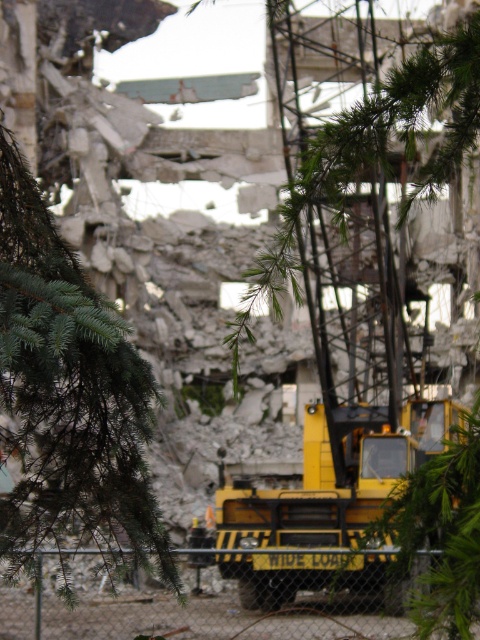
Does green needle-like leaves at left have a lesser width compared to metal chain-link fence at center?

Indeed, green needle-like leaves at left has a lesser width compared to metal chain-link fence at center.

Can you confirm if green needle-like leaves at left is positioned to the left of metal chain-link fence at center?

Yes, green needle-like leaves at left is to the left of metal chain-link fence at center.

Who is more forward, (71, 376) or (360, 586)?

Point (71, 376)

You are a GUI agent. You are given a task and a screenshot of the screen. Output one action in this format:
    pyautogui.click(x=<x>, y=<y>)
    Task: Click on the green needle-like leaves at left
    The image size is (480, 640).
    Given the screenshot: What is the action you would take?
    pyautogui.click(x=68, y=394)

Does green needle-like leaves at left have a greater width compared to green needle-like branches at center?

No.

Is point (44, 524) closer to viewer compared to point (399, 77)?

Yes, it is in front of point (399, 77).

Who is more distant from viewer, (62, 403) or (302, 243)?

The point (302, 243) is more distant.

Locate an element on the screen. The height and width of the screenshot is (640, 480). green needle-like leaves at left is located at coordinates (68, 394).

Between point (333, 198) and point (108, 611), which one is positioned behind?

Point (108, 611)

Can you confirm if green needle-like branches at center is wider than metal chain-link fence at center?

Correct, the width of green needle-like branches at center exceeds that of metal chain-link fence at center.

Does point (307, 301) lie in front of point (300, 577)?

No, (307, 301) is further to viewer.

Locate an element on the screen. green needle-like branches at center is located at coordinates (376, 147).